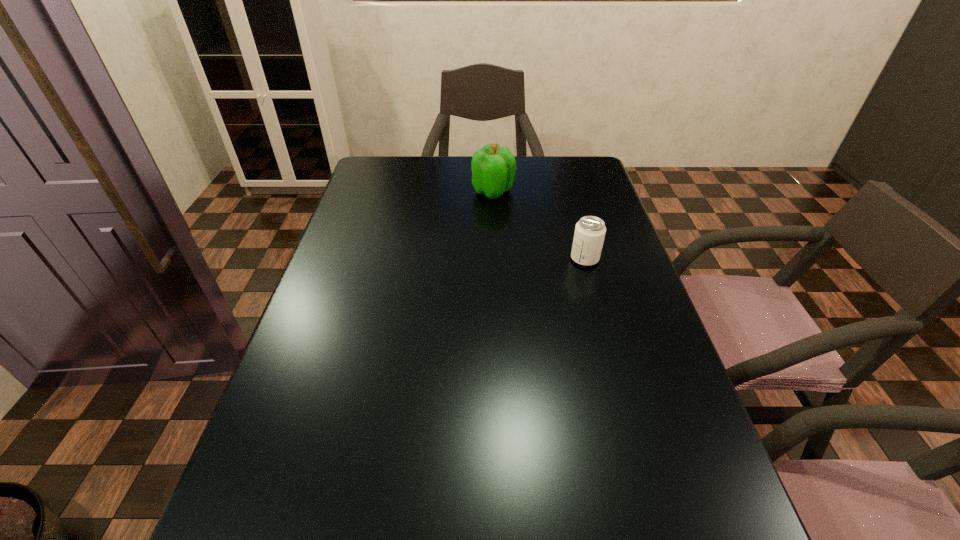
In the image, there is a desktop. At what (x,y) coordinates should I click in order to perform the action: click on vacant space at the right edge. Please return your answer as a coordinate pair (x, y). Image resolution: width=960 pixels, height=540 pixels. Looking at the image, I should click on (583, 293).

The height and width of the screenshot is (540, 960). Identify the location of vacant space at the far left corner of the desktop. (361, 184).

This screenshot has height=540, width=960. Find the location of `vacant space at the far right corner`. vacant space at the far right corner is located at coordinates (602, 184).

Identify the location of free space that satisfies the following two spatial constraints: 1. on the front side of the farther object; 2. on the right side of the right object. The image size is (960, 540). (496, 259).

Locate an element on the screen. free spot that satisfies the following two spatial constraints: 1. on the front side of the farther object; 2. on the left side of the nearer object is located at coordinates (496, 259).